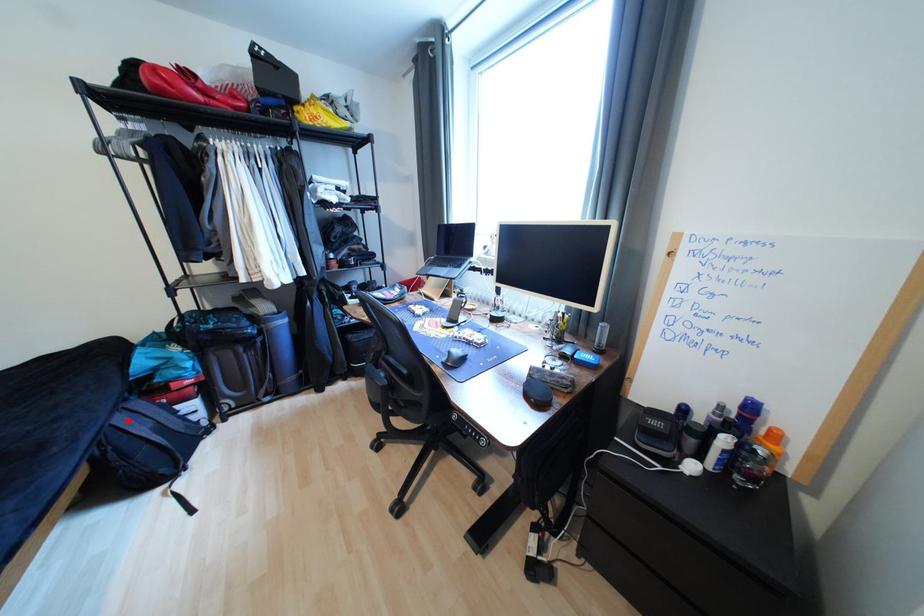
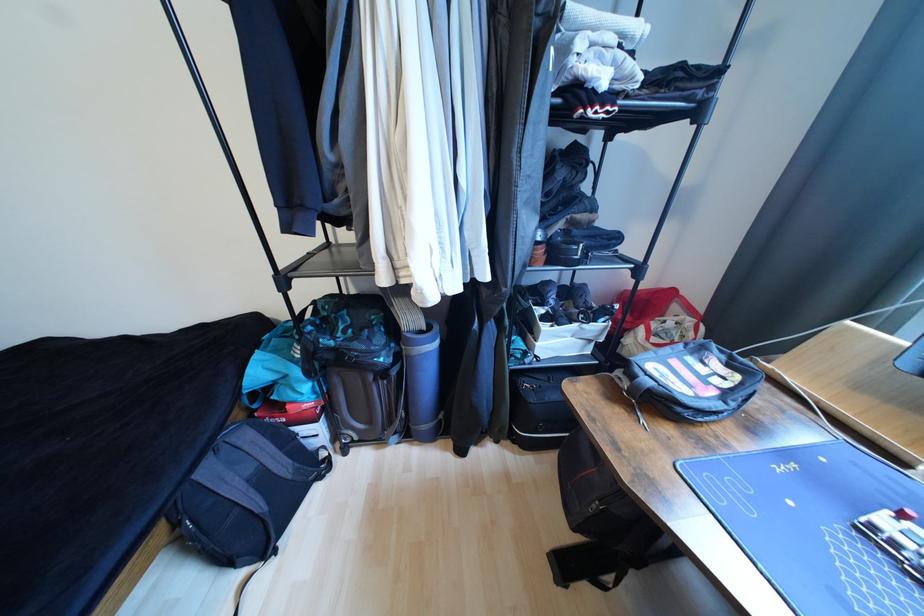
Question: I am providing you with two images of the same scene from different viewpoints. A red point is shown in image1. For the corresponding object point in image2, is it positioned nearer or farther from the camera?

Choices:
 (A) Nearer
 (B) Farther

Answer: (A)